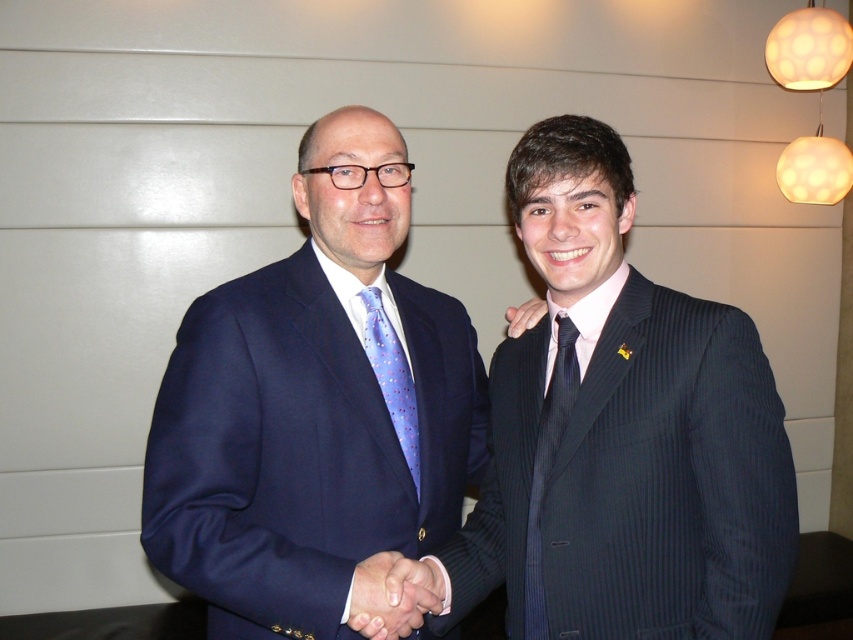
Question: Which point is closer to the camera?

Choices:
 (A) (466, 381)
 (B) (730, 449)
 (C) (560, 394)
 (D) (401, 428)

Answer: (B)

Question: Can you confirm if black silk tie at right is wider than smooth leather hand at center?

Choices:
 (A) no
 (B) yes

Answer: (A)

Question: Is black silk tie at right smaller than blue dotted tie at center?

Choices:
 (A) no
 (B) yes

Answer: (A)

Question: Can you confirm if black silk tie at right is wider than smooth leather hand at center?

Choices:
 (A) no
 (B) yes

Answer: (A)

Question: Estimate the real-world distances between objects in this image. Which object is closer to the matte blue suit at center?

Choices:
 (A) black silk tie at right
 (B) matte black hand at center
 (C) blue dotted tie at center
 (D) dark blue pinstripe suit at center

Answer: (C)

Question: Which point is farther to the camera?

Choices:
 (A) (361, 609)
 (B) (425, 508)

Answer: (B)